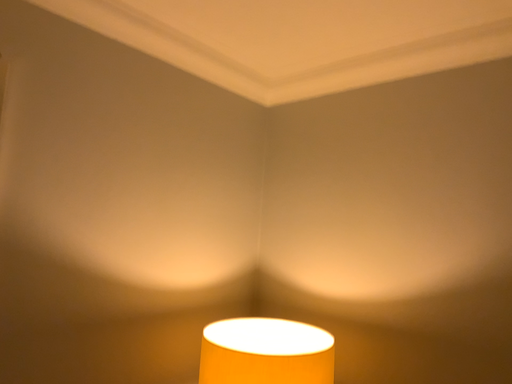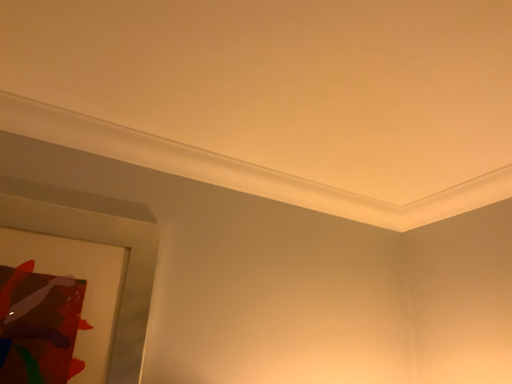
Question: Which way did the camera rotate in the video?

Choices:
 (A) rotated left
 (B) rotated right

Answer: (A)